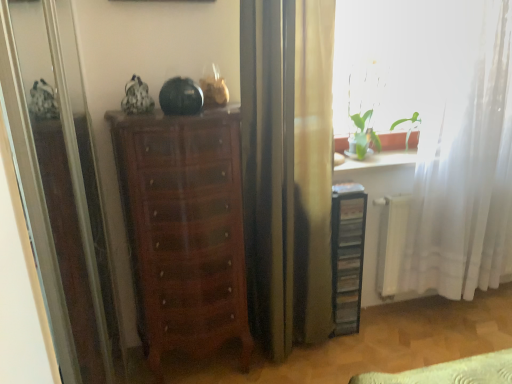
Question: Is transparent glass screen door at left bigger or smaller than shiny brown chest of drawers at center?

Choices:
 (A) small
 (B) big

Answer: (A)

Question: Looking at their shapes, would you say transparent glass screen door at left is wider or thinner than shiny brown chest of drawers at center?

Choices:
 (A) thin
 (B) wide

Answer: (A)

Question: Based on their relative distances, which object is farther from the transparent glass screen door at left?

Choices:
 (A) white sheer curtain at right
 (B) shiny brown chest of drawers at center
 (C) black plastic file cabinet at right

Answer: (A)

Question: Based on their relative distances, which object is nearer to the shiny brown chest of drawers at center?

Choices:
 (A) black plastic file cabinet at right
 (B) white sheer curtain at right
 (C) transparent glass screen door at left

Answer: (C)